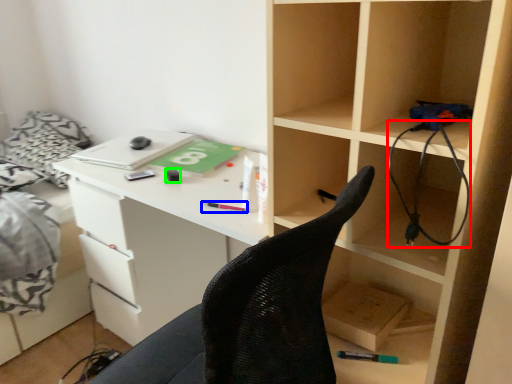
Question: Based on their relative distances, which object is nearer to wire (highlighted by a red box)? Choose from stationery (highlighted by a blue box) and stationery (highlighted by a green box).

Choices:
 (A) stationery
 (B) stationery

Answer: (A)